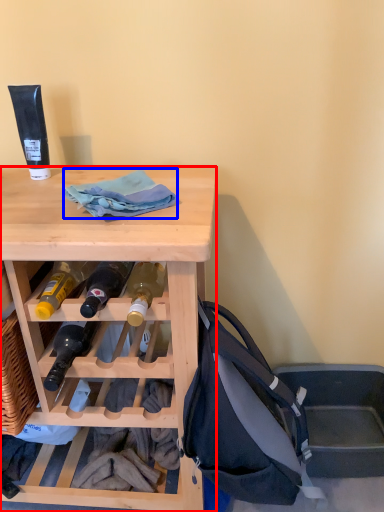
Question: Among these objects, which one is nearest to the camera, desk (highlighted by a red box) or cloth (highlighted by a blue box)?

Choices:
 (A) desk
 (B) cloth

Answer: (A)